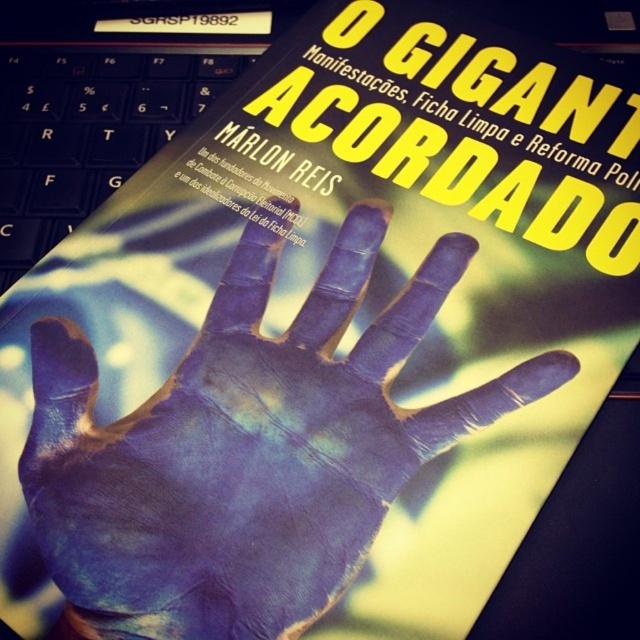
Question: Is blue painted hand at center positioned at the back of black plastic keyboard at upper left?

Choices:
 (A) no
 (B) yes

Answer: (A)

Question: Which point appears closest to the camera in this image?

Choices:
 (A) (180, 124)
 (B) (131, 614)

Answer: (B)

Question: Where is blue painted hand at center located in relation to black plastic keyboard at upper left in the image?

Choices:
 (A) below
 (B) above

Answer: (A)

Question: Does blue painted hand at center appear over black plastic keyboard at upper left?

Choices:
 (A) no
 (B) yes

Answer: (A)

Question: Which point is closer to the camera taking this photo?

Choices:
 (A) (104, 90)
 (B) (344, 227)

Answer: (B)